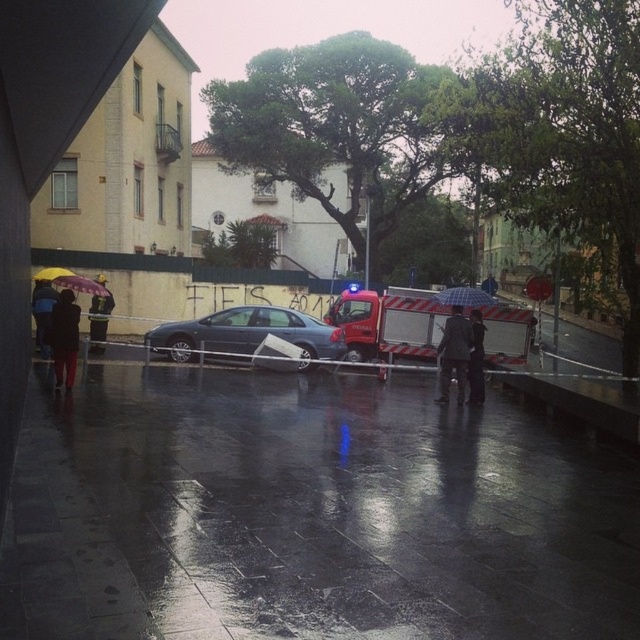
Question: Does dark matte jacket at lower left come behind dark gray fabric jacket at center?

Choices:
 (A) no
 (B) yes

Answer: (A)

Question: Which point appears farthest from the camera in this image?

Choices:
 (A) (246, 625)
 (B) (45, 340)

Answer: (B)

Question: Is dark gray fabric jacket at center thinner than yellow matte umbrella at left?

Choices:
 (A) no
 (B) yes

Answer: (A)

Question: Where is satin black sedan at center located in relation to plastic checkered umbrella at center in the image?

Choices:
 (A) left
 (B) right

Answer: (A)

Question: Among these points, which one is nearest to the camera?

Choices:
 (A) (442, 300)
 (B) (44, 280)
 (C) (52, 323)

Answer: (C)

Question: Based on their relative distances, which object is farther from the yellow matte umbrella at left?

Choices:
 (A) satin black sedan at center
 (B) plastic checkered umbrella at center
 (C) metallic red fire truck at center
 (D) dark fabric umbrella at center

Answer: (B)